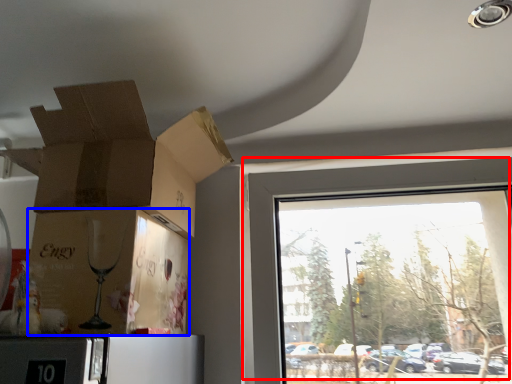
Question: Which point is further to the camera, window (highlighted by a red box) or cardboard box (highlighted by a blue box)?

Choices:
 (A) window
 (B) cardboard box

Answer: (A)